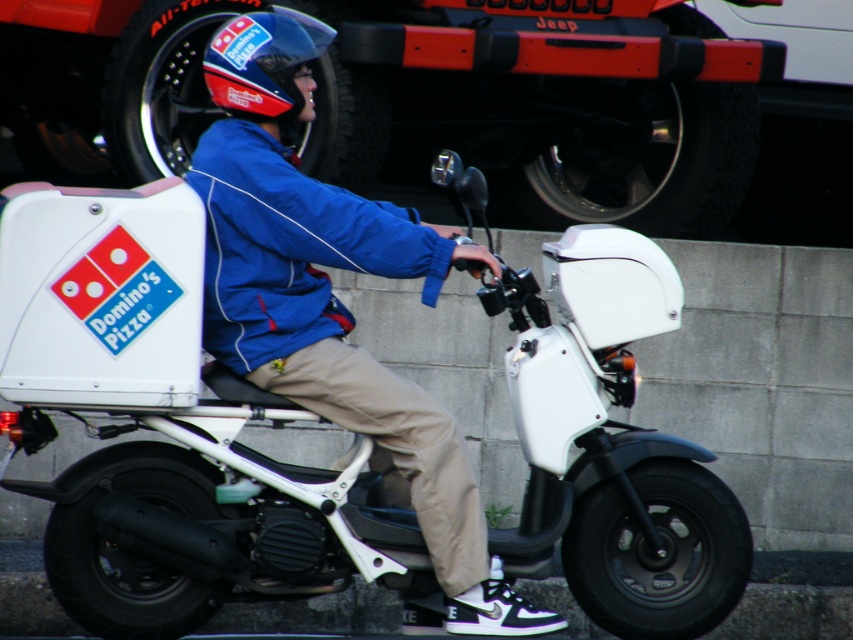
Question: Can you confirm if white matte motorcycle at center is positioned to the right of blue fabric jacket at center?

Choices:
 (A) no
 (B) yes

Answer: (B)

Question: Which object is positioned farthest from the white matte motorcycle at center?

Choices:
 (A) shiny blue helmet at center
 (B) blue fabric jacket at center

Answer: (A)

Question: Among these objects, which one is nearest to the camera?

Choices:
 (A) white matte motorcycle at center
 (B) shiny blue helmet at center
 (C) blue fabric jacket at center

Answer: (C)

Question: Which object is farther from the camera taking this photo?

Choices:
 (A) blue fabric jacket at center
 (B) white matte motorcycle at center

Answer: (B)

Question: Can you confirm if blue fabric jacket at center is smaller than shiny blue helmet at center?

Choices:
 (A) no
 (B) yes

Answer: (A)

Question: From the image, what is the correct spatial relationship of blue fabric jacket at center in relation to shiny blue helmet at center?

Choices:
 (A) below
 (B) above

Answer: (A)